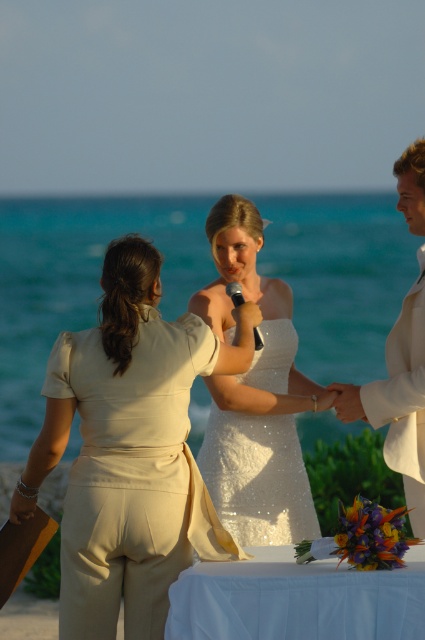
Does white cloth table at center have a smaller size compared to white satin suit at right?

Yes, white cloth table at center is smaller than white satin suit at right.

Between white cloth table at center and white satin suit at right, which one has more height?

With more height is white satin suit at right.

Where is `white cloth table at center`? white cloth table at center is located at coordinates (297, 600).

Between point (142, 413) and point (257, 611), which one is positioned in front?

Point (257, 611)

Is point (149, 358) positioned in front of point (209, 593)?

No, (149, 358) is further to viewer.

Who is more distant from viewer, (x=73, y=634) or (x=184, y=570)?

The point (x=73, y=634) is behind.

Locate an element on the screen. beige satin jumpsuit at center is located at coordinates (130, 449).

Who is positioned more to the left, white sequined dress at center or white satin suit at right?

white sequined dress at center is more to the left.

Does white sequined dress at center have a larger size compared to white satin suit at right?

Yes, white sequined dress at center is bigger than white satin suit at right.

Does point (263, 472) lie in front of point (416, 349)?

No, (263, 472) is behind (416, 349).

The height and width of the screenshot is (640, 425). I want to click on white sequined dress at center, so click(x=255, y=396).